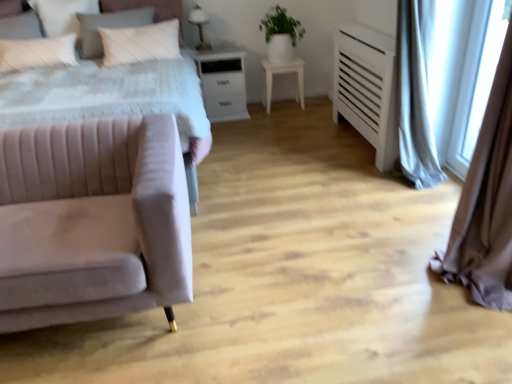
Question: From a real-world perspective, is white glossy nightstand at center over white matte table at center?

Choices:
 (A) no
 (B) yes

Answer: (B)

Question: Is white glossy nightstand at center positioned with its back to white matte table at center?

Choices:
 (A) no
 (B) yes

Answer: (A)

Question: Is white glossy nightstand at center wider than white matte table at center?

Choices:
 (A) yes
 (B) no

Answer: (A)

Question: Considering the relative positions of white glossy nightstand at center and white matte table at center in the image provided, is white glossy nightstand at center to the left of white matte table at center from the viewer's perspective?

Choices:
 (A) no
 (B) yes

Answer: (B)

Question: Considering the relative sizes of white glossy nightstand at center and white matte table at center in the image provided, is white glossy nightstand at center smaller than white matte table at center?

Choices:
 (A) yes
 (B) no

Answer: (B)

Question: Is white glossy nightstand at center shorter than white matte table at center?

Choices:
 (A) yes
 (B) no

Answer: (B)

Question: From a real-world perspective, is white glossy table lamp at upper center below light gray fabric curtain at right?

Choices:
 (A) yes
 (B) no

Answer: (B)

Question: Is light gray fabric curtain at right at the back of white glossy table lamp at upper center?

Choices:
 (A) yes
 (B) no

Answer: (B)

Question: Is light gray fabric curtain at right a part of white glossy table lamp at upper center?

Choices:
 (A) yes
 (B) no

Answer: (B)

Question: Could you tell me if white glossy table lamp at upper center is facing light gray fabric curtain at right?

Choices:
 (A) no
 (B) yes

Answer: (A)

Question: Can you confirm if white glossy table lamp at upper center is smaller than light gray fabric curtain at right?

Choices:
 (A) no
 (B) yes

Answer: (B)

Question: Considering the relative sizes of white glossy table lamp at upper center and light gray fabric curtain at right in the image provided, is white glossy table lamp at upper center shorter than light gray fabric curtain at right?

Choices:
 (A) yes
 (B) no

Answer: (A)

Question: Considering the relative sizes of white matte table at center and white quilted pillow at upper left, which is counted as the first pillow, starting from the right, in the image provided, is white matte table at center smaller than white quilted pillow at upper left, which is counted as the first pillow, starting from the right,?

Choices:
 (A) yes
 (B) no

Answer: (A)